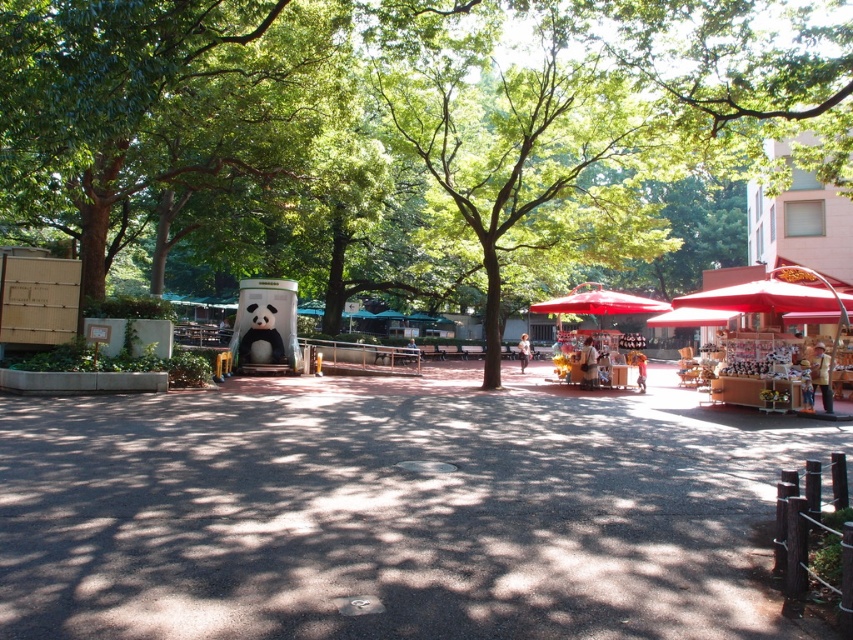
Question: From the image, what is the correct spatial relationship of green leafy tree at center in relation to yellow fabric vendor at lower right?

Choices:
 (A) above
 (B) below

Answer: (A)

Question: Which point is closer to the camera taking this photo?

Choices:
 (A) (589, 364)
 (B) (618, 308)

Answer: (A)

Question: Which point is closer to the camera taking this photo?

Choices:
 (A) (822, 401)
 (B) (527, 346)

Answer: (A)

Question: Which object is farther from the camera taking this photo?

Choices:
 (A) matte white vendor at center
 (B) yellow fabric vendor at lower right
 (C) matte brown vendor at center
 (D) matte red umbrella at center

Answer: (A)

Question: Can you confirm if matte brown vendor at center is wider than matte white vendor at center?

Choices:
 (A) yes
 (B) no

Answer: (B)

Question: In this image, where is yellow fabric vendor at lower right located relative to matte brown vendor at center?

Choices:
 (A) right
 (B) left

Answer: (A)